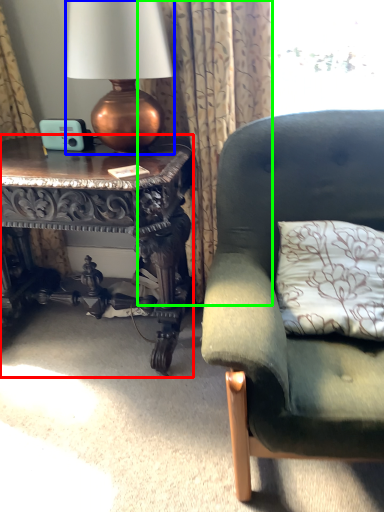
Question: Based on their relative distances, which object is farther from table (highlighted by a red box)? Choose from lamp (highlighted by a blue box) and curtain (highlighted by a green box).

Choices:
 (A) lamp
 (B) curtain

Answer: (A)